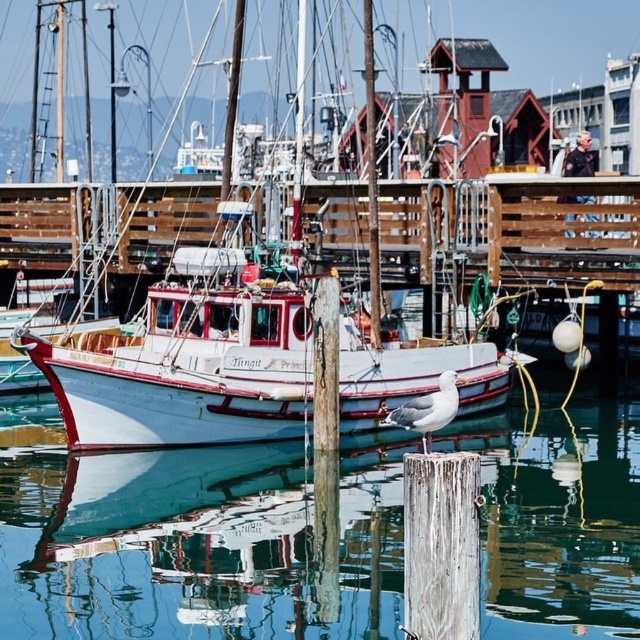
Is white glossy boat at center shorter than white matte boat at center?

No, white glossy boat at center is not shorter than white matte boat at center.

Which is behind, point (371, 371) or point (262, 340)?

Point (371, 371)

Find the location of `white glossy boat at center`. white glossy boat at center is located at coordinates (189, 358).

Can you confirm if clear water at center is thinner than white feathered seagull at center?

No.

Where is `clear water at center`? The width and height of the screenshot is (640, 640). clear water at center is located at coordinates (188, 538).

Is point (288, 401) positioned before point (426, 429)?

No, (288, 401) is further to viewer.

How far apart are white matte boat at center and white feathered seagull at center?

The distance of white matte boat at center from white feathered seagull at center is 7.98 meters.

Image resolution: width=640 pixels, height=640 pixels. Find the location of `white matte boat at center`. white matte boat at center is located at coordinates (189, 364).